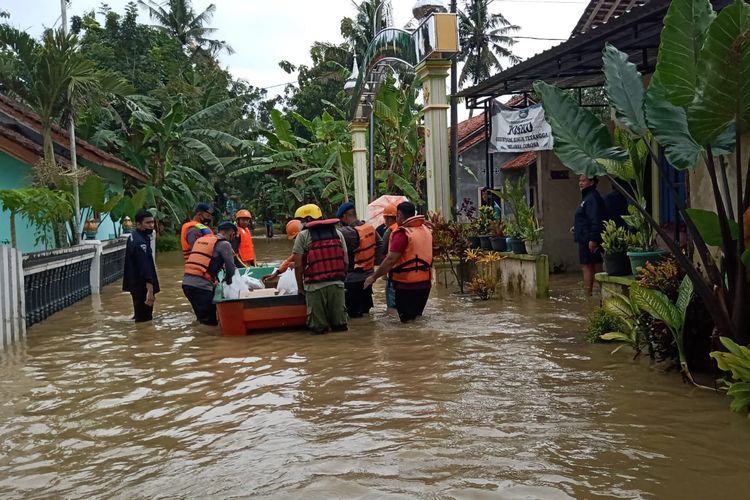
Where is `pillars`? The height and width of the screenshot is (500, 750). pillars is located at coordinates (438, 151), (364, 175).